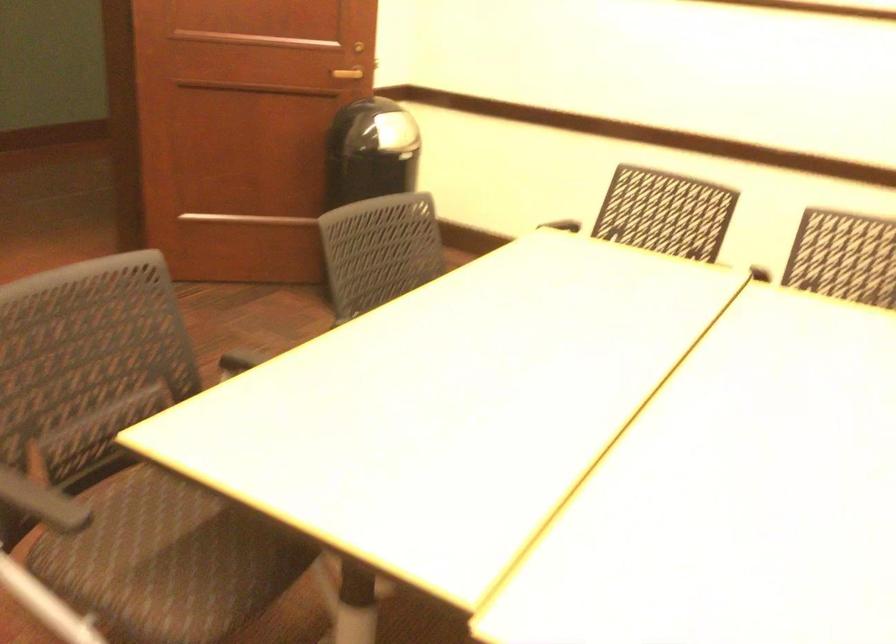
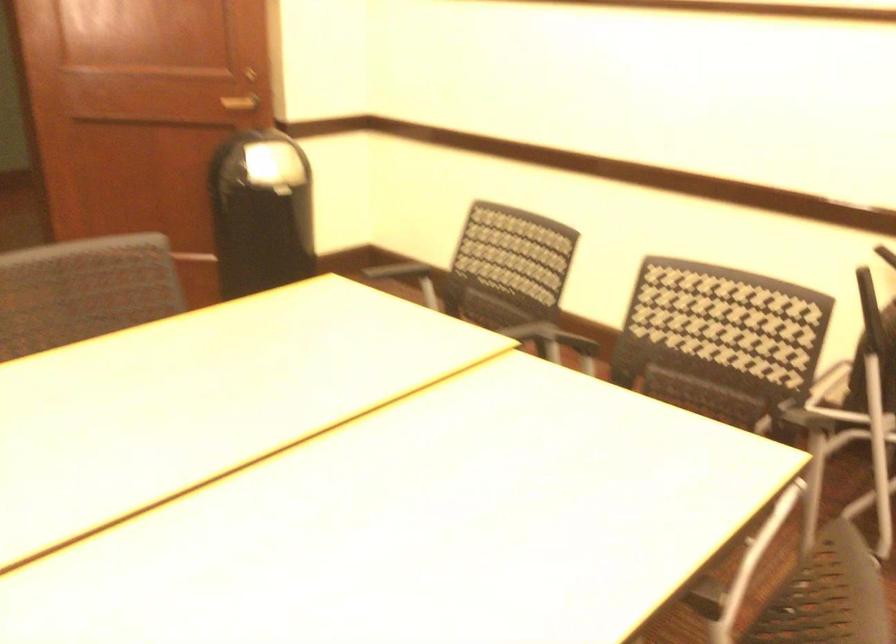
The point at (675,274) is marked in the first image. Where is the corresponding point in the second image?

(446, 332)